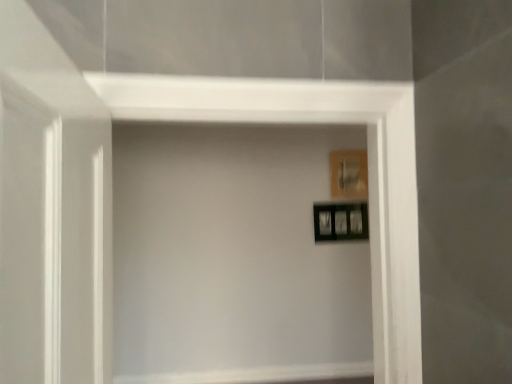
Find the location of a particular element. wooden picture frame at upper right, the 2th picture frame positioned from the bottom is located at coordinates (349, 175).

Locate an element on the screen. transparent glass door at left is located at coordinates (54, 243).

Where is `wooden picture frame at upper right, which is the 1th picture frame in top-to-bottom order`? The image size is (512, 384). wooden picture frame at upper right, which is the 1th picture frame in top-to-bottom order is located at coordinates (349, 175).

Looking at this image, how different are the orientations of black glossy picture frame at upper right, the 2th picture frame from the top, and wooden picture frame at upper right, which is the 1th picture frame in top-to-bottom order, in degrees?

0.000151 degrees.

Identify the location of picture frame located on the right of black glossy picture frame at upper right, which appears as the 1th picture frame when ordered from the bottom. (349, 175).

From the image's perspective, which is above, black glossy picture frame at upper right, the 2th picture frame from the top, or wooden picture frame at upper right, which is the 1th picture frame in top-to-bottom order?

wooden picture frame at upper right, which is the 1th picture frame in top-to-bottom order, is shown above in the image.

Considering the points (355, 231) and (353, 156), which point is in front, point (355, 231) or point (353, 156)?

Positioned in front is point (355, 231).

From a real-world perspective, who is located lower, transparent glass door at left or black glossy picture frame at upper right, the 2th picture frame from the top?

transparent glass door at left.

Is transparent glass door at left far from black glossy picture frame at upper right, which appears as the 1th picture frame when ordered from the bottom?

transparent glass door at left is positioned a significant distance from black glossy picture frame at upper right, which appears as the 1th picture frame when ordered from the bottom.

Consider the image. Which object is more forward, transparent glass door at left or black glossy picture frame at upper right, the 2th picture frame from the top?

transparent glass door at left is more forward.

Which object is positioned more to the left, transparent glass door at left or black glossy picture frame at upper right, the 2th picture frame from the top?

transparent glass door at left is more to the left.

Looking at this image, are black glossy picture frame at upper right, the 2th picture frame from the top, and transparent glass door at left making contact?

No, black glossy picture frame at upper right, the 2th picture frame from the top, is not in contact with transparent glass door at left.

From the image's perspective, between black glossy picture frame at upper right, which appears as the 1th picture frame when ordered from the bottom, and transparent glass door at left, who is located below?

From the image's view, black glossy picture frame at upper right, which appears as the 1th picture frame when ordered from the bottom, is below.

Is black glossy picture frame at upper right, the 2th picture frame from the top, turned away from transparent glass door at left?

No, black glossy picture frame at upper right, the 2th picture frame from the top, is not facing the opposite direction of transparent glass door at left.

Between black glossy picture frame at upper right, the 2th picture frame from the top, and transparent glass door at left, which one has larger size?

transparent glass door at left is bigger.

Can you confirm if wooden picture frame at upper right, the 2th picture frame positioned from the bottom, is wider than transparent glass door at left?

In fact, wooden picture frame at upper right, the 2th picture frame positioned from the bottom, might be narrower than transparent glass door at left.

Is wooden picture frame at upper right, which is the 1th picture frame in top-to-bottom order, positioned beyond the bounds of transparent glass door at left?

Absolutely, wooden picture frame at upper right, which is the 1th picture frame in top-to-bottom order, is external to transparent glass door at left.

Between wooden picture frame at upper right, the 2th picture frame positioned from the bottom, and transparent glass door at left, which one has larger size?

With larger size is transparent glass door at left.

Could you tell me if wooden picture frame at upper right, which is the 1th picture frame in top-to-bottom order, is facing transparent glass door at left?

No, wooden picture frame at upper right, which is the 1th picture frame in top-to-bottom order, is not oriented towards transparent glass door at left.

Based on the photo, considering the sizes of wooden picture frame at upper right, the 2th picture frame positioned from the bottom, and black glossy picture frame at upper right, which appears as the 1th picture frame when ordered from the bottom, in the image, is wooden picture frame at upper right, the 2th picture frame positioned from the bottom, bigger or smaller than black glossy picture frame at upper right, which appears as the 1th picture frame when ordered from the bottom,?

wooden picture frame at upper right, the 2th picture frame positioned from the bottom, is smaller than black glossy picture frame at upper right, which appears as the 1th picture frame when ordered from the bottom.

Considering the positions of objects wooden picture frame at upper right, which is the 1th picture frame in top-to-bottom order, and black glossy picture frame at upper right, which appears as the 1th picture frame when ordered from the bottom, in the image provided, who is more to the left, wooden picture frame at upper right, which is the 1th picture frame in top-to-bottom order, or black glossy picture frame at upper right, which appears as the 1th picture frame when ordered from the bottom,?

Positioned to the left is black glossy picture frame at upper right, which appears as the 1th picture frame when ordered from the bottom.

Which is more distant, (x=347, y=167) or (x=324, y=239)?

The point (x=347, y=167) is farther from the camera.

Does wooden picture frame at upper right, the 2th picture frame positioned from the bottom, contain black glossy picture frame at upper right, the 2th picture frame from the top?

No, black glossy picture frame at upper right, the 2th picture frame from the top, is located outside of wooden picture frame at upper right, the 2th picture frame positioned from the bottom.

Which of these two, transparent glass door at left or wooden picture frame at upper right, the 2th picture frame positioned from the bottom, is wider?

transparent glass door at left.

Could you measure the distance between transparent glass door at left and wooden picture frame at upper right, the 2th picture frame positioned from the bottom?

transparent glass door at left and wooden picture frame at upper right, the 2th picture frame positioned from the bottom, are 1.66 meters apart.

Between point (4, 191) and point (344, 189), which one is positioned behind?

The point (344, 189) is behind.

How different are the orientations of transparent glass door at left and wooden picture frame at upper right, which is the 1th picture frame in top-to-bottom order, in degrees?

The facing directions of transparent glass door at left and wooden picture frame at upper right, which is the 1th picture frame in top-to-bottom order, are 91 degrees apart.

I want to click on picture frame on the right of the black glossy picture frame at upper right, the 2th picture frame from the top, so click(x=349, y=175).

This screenshot has width=512, height=384. What are the coordinates of `glass door in front of the black glossy picture frame at upper right, the 2th picture frame from the top` in the screenshot? It's located at (54, 243).

Estimate the real-world distances between objects in this image. Which object is closer to wooden picture frame at upper right, the 2th picture frame positioned from the bottom, black glossy picture frame at upper right, the 2th picture frame from the top, or transparent glass door at left?

black glossy picture frame at upper right, the 2th picture frame from the top, lies closer to wooden picture frame at upper right, the 2th picture frame positioned from the bottom, than the other object.

Based on their spatial positions, is black glossy picture frame at upper right, which appears as the 1th picture frame when ordered from the bottom, or wooden picture frame at upper right, which is the 1th picture frame in top-to-bottom order, further from transparent glass door at left?

Among the two, wooden picture frame at upper right, which is the 1th picture frame in top-to-bottom order, is located further to transparent glass door at left.

Estimate the real-world distances between objects in this image. Which object is further from black glossy picture frame at upper right, which appears as the 1th picture frame when ordered from the bottom, transparent glass door at left or wooden picture frame at upper right, which is the 1th picture frame in top-to-bottom order?

The object further to black glossy picture frame at upper right, which appears as the 1th picture frame when ordered from the bottom, is transparent glass door at left.

When comparing their distances from wooden picture frame at upper right, which is the 1th picture frame in top-to-bottom order, does transparent glass door at left or black glossy picture frame at upper right, the 2th picture frame from the top, seem closer?

black glossy picture frame at upper right, the 2th picture frame from the top, is positioned closer to the anchor wooden picture frame at upper right, which is the 1th picture frame in top-to-bottom order.

Considering their positions, is wooden picture frame at upper right, which is the 1th picture frame in top-to-bottom order, positioned closer to transparent glass door at left than black glossy picture frame at upper right, the 2th picture frame from the top?

black glossy picture frame at upper right, the 2th picture frame from the top, lies closer to transparent glass door at left than the other object.

Which object lies further to the anchor point black glossy picture frame at upper right, which appears as the 1th picture frame when ordered from the bottom, wooden picture frame at upper right, which is the 1th picture frame in top-to-bottom order, or transparent glass door at left?

transparent glass door at left lies further to black glossy picture frame at upper right, which appears as the 1th picture frame when ordered from the bottom, than the other object.

Locate an element on the screen. Image resolution: width=512 pixels, height=384 pixels. picture frame between transparent glass door at left and wooden picture frame at upper right, which is the 1th picture frame in top-to-bottom order, in the front-back direction is located at coordinates (340, 221).